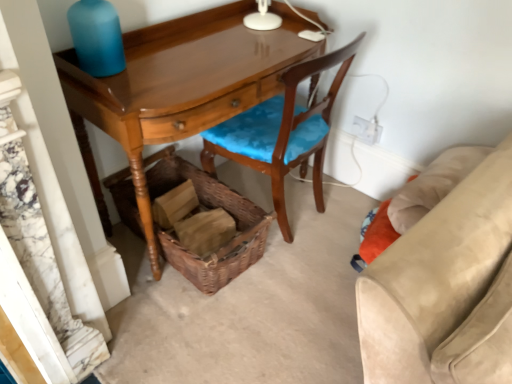
Question: Should I look upward or downward to see blue matte bottle at upper left?

Choices:
 (A) down
 (B) up

Answer: (B)

Question: Is wooden chair with blue cushion at center further to the viewer compared to white plastic power outlet at upper right?

Choices:
 (A) no
 (B) yes

Answer: (A)

Question: Does wooden chair with blue cushion at center turn towards white plastic power outlet at upper right?

Choices:
 (A) yes
 (B) no

Answer: (B)

Question: Would you say wooden chair with blue cushion at center is outside white plastic power outlet at upper right?

Choices:
 (A) no
 (B) yes

Answer: (B)

Question: Does wooden chair with blue cushion at center have a greater height compared to white plastic power outlet at upper right?

Choices:
 (A) no
 (B) yes

Answer: (B)

Question: Is white plastic power outlet at upper right at the back of wooden chair with blue cushion at center?

Choices:
 (A) yes
 (B) no

Answer: (B)

Question: Considering the relative positions of wooden chair with blue cushion at center and white plastic power outlet at upper right in the image provided, is wooden chair with blue cushion at center to the right of white plastic power outlet at upper right from the viewer's perspective?

Choices:
 (A) no
 (B) yes

Answer: (A)

Question: From the image's perspective, is glossy wood desk at center on top of wooden chair with blue cushion at center?

Choices:
 (A) yes
 (B) no

Answer: (B)

Question: Considering the relative sizes of glossy wood desk at center and wooden chair with blue cushion at center in the image provided, is glossy wood desk at center wider than wooden chair with blue cushion at center?

Choices:
 (A) yes
 (B) no

Answer: (A)

Question: Can wooden chair with blue cushion at center be found inside glossy wood desk at center?

Choices:
 (A) no
 (B) yes

Answer: (B)

Question: Can you confirm if glossy wood desk at center is positioned to the right of wooden chair with blue cushion at center?

Choices:
 (A) no
 (B) yes

Answer: (A)

Question: Can we say glossy wood desk at center lies outside wooden chair with blue cushion at center?

Choices:
 (A) yes
 (B) no

Answer: (A)

Question: Does glossy wood desk at center have a greater height compared to wooden chair with blue cushion at center?

Choices:
 (A) no
 (B) yes

Answer: (A)

Question: Is woven brown picnic basket at lower center at the left side of white plastic power outlet at upper right?

Choices:
 (A) yes
 (B) no

Answer: (A)